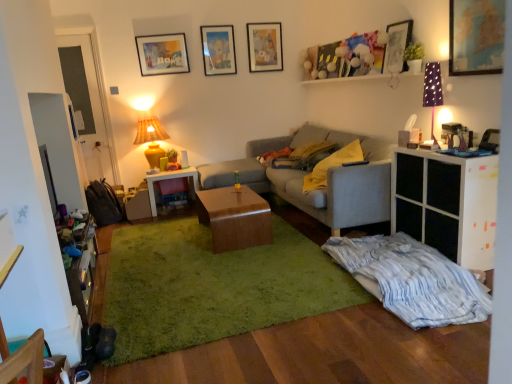
Question: Is point (175, 175) positioned closer to the camera than point (318, 206)?

Choices:
 (A) farther
 (B) closer

Answer: (A)

Question: From the image's perspective, is white glossy desk at center located above or below gray fabric couch at center?

Choices:
 (A) below
 (B) above

Answer: (A)

Question: Based on their relative distances, which object is farther from the matte wooden picture frame at upper center, positioned as the 4th picture frame in right-to-left order?

Choices:
 (A) wooden armchair at lower left
 (B) matte wooden picture frame at upper center, which is the fifth picture frame in front-to-back order
 (C) gray fabric couch at center
 (D) wooden dresser at lower left
 (E) matte yellow ceramic lamp at upper left, the 2th lamp viewed from the front

Answer: (A)

Question: Estimate the real-world distances between objects in this image. Which object is closer to the yellow fabric pillow at center?

Choices:
 (A) matte wooden picture frame at upper center, marked as the fourth picture frame in a front-to-back arrangement
 (B) map paper picture frame at upper right, positioned as the 5th picture frame in left-to-right order
 (C) matte paper picture frame at upper center, the third picture frame in the back-to-front sequence
 (D) matte black picture frame at upper right, the 4th picture frame when ordered from left to right
 (E) matte yellow ceramic lamp at upper left, the 1th lamp from the left

Answer: (D)